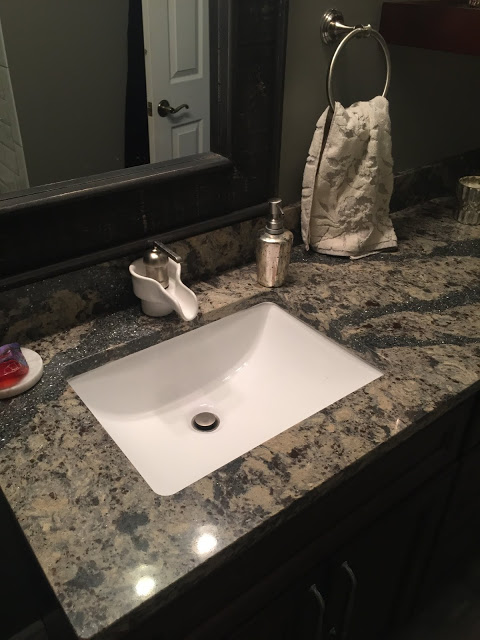
Where is `sink`? sink is located at coordinates (315, 394).